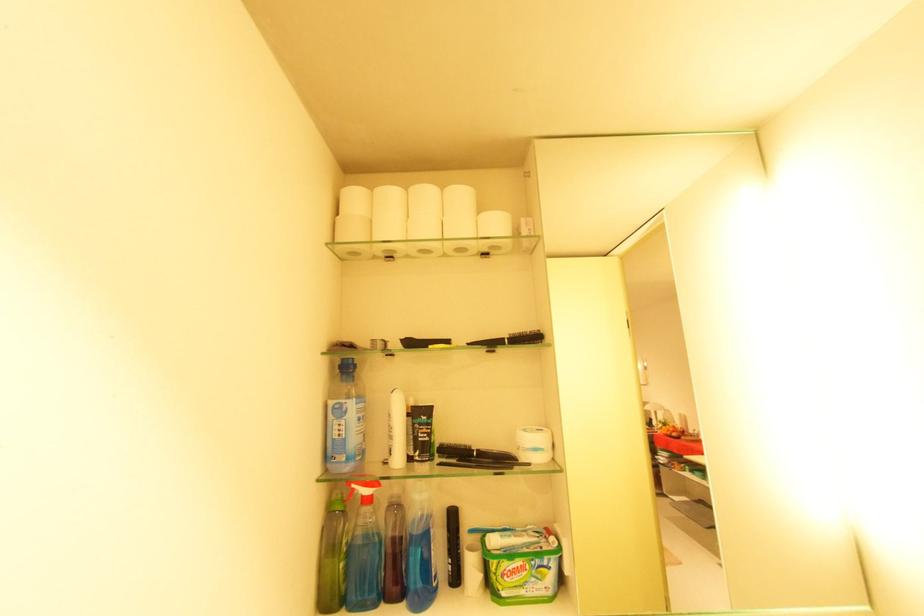
Where is `white jar lid`? The height and width of the screenshot is (616, 924). white jar lid is located at coordinates (537, 437).